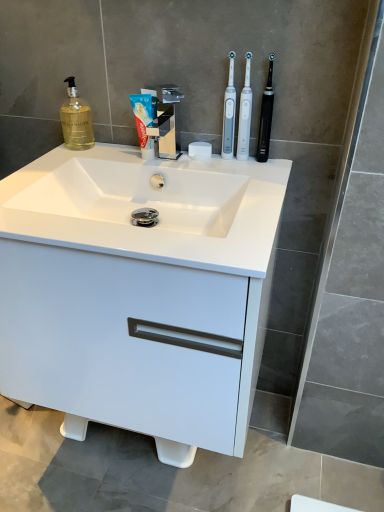
Where is `unoccupied region to the right of translucent glass soap dispenser at upper left`? This screenshot has height=512, width=384. unoccupied region to the right of translucent glass soap dispenser at upper left is located at coordinates (117, 150).